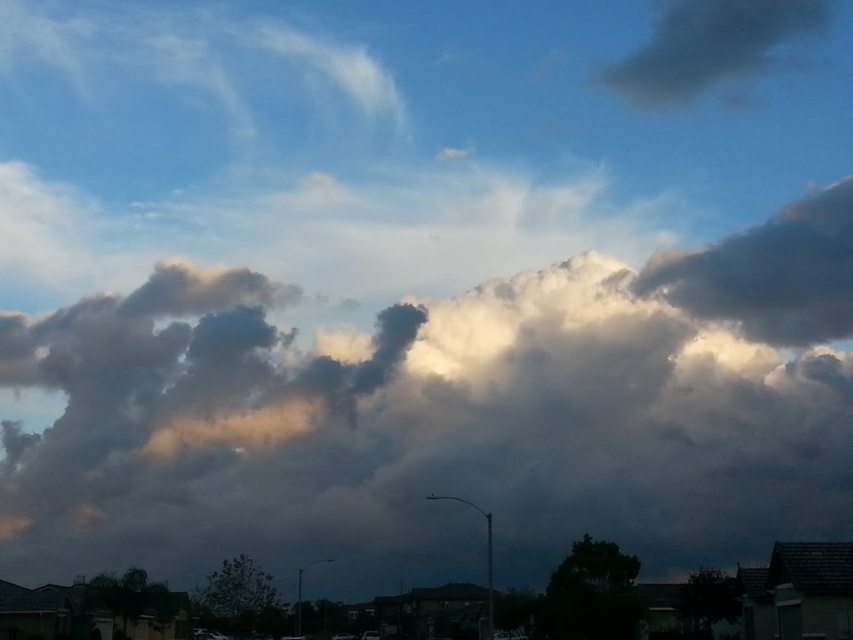
Which is more to the right, cloudy at upper center or dark green leafy tree at lower center?

dark green leafy tree at lower center

Is point (705, 308) closer to viewer compared to point (614, 637)?

That is False.

The height and width of the screenshot is (640, 853). I want to click on cloudy at upper center, so click(445, 413).

Describe the element at coordinates (712, 45) in the screenshot. I see `dark gray cloud at upper right` at that location.

Is dark gray cloud at upper right above dark green leafy tree at lower center?

Indeed, dark gray cloud at upper right is positioned over dark green leafy tree at lower center.

The width and height of the screenshot is (853, 640). What do you see at coordinates (712, 45) in the screenshot? I see `dark gray cloud at upper right` at bounding box center [712, 45].

The height and width of the screenshot is (640, 853). Identify the location of dark gray cloud at upper right. (712, 45).

Which is more to the left, cloudy at upper center or dark gray cloud at upper right?

From the viewer's perspective, cloudy at upper center appears more on the left side.

Is the position of cloudy at upper center more distant than that of dark gray cloud at upper right?

No.

Which is in front, point (583, 259) or point (682, 67)?

Point (583, 259) is in front.

The image size is (853, 640). Identify the location of cloudy at upper center. (445, 413).